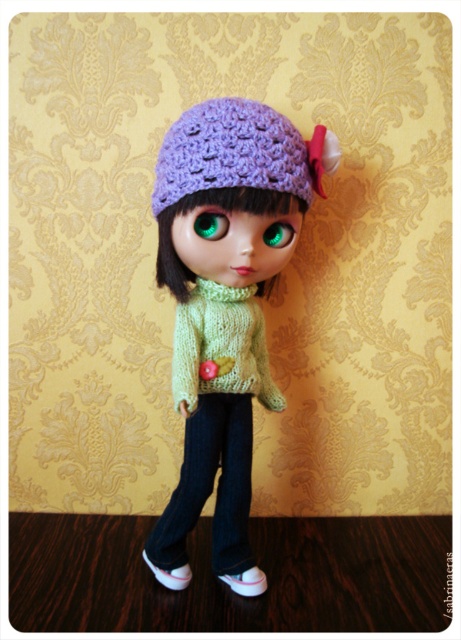
Question: Observing the image, what is the correct spatial positioning of knitted green sweater at center in reference to green glossy eye at center?

Choices:
 (A) above
 (B) below

Answer: (B)

Question: Which object is the closest to the green glossy eye at center?

Choices:
 (A) lavender crocheted hat at center
 (B) green matte eye at center

Answer: (B)

Question: Is lavender crocheted hat at center positioned behind green matte eye at center?

Choices:
 (A) no
 (B) yes

Answer: (A)

Question: Which object appears farthest from the camera in this image?

Choices:
 (A) white matte shoe at lower center
 (B) lavender knitted beanie at center
 (C) green matte eye at center
 (D) white matte shoe at lower left

Answer: (A)

Question: Can you confirm if white matte shoe at lower left is wider than green matte eye at center?

Choices:
 (A) no
 (B) yes

Answer: (B)

Question: Which of these objects is positioned closest to the lavender crocheted hat at center?

Choices:
 (A) green matte eye at center
 (B) knitted green sweater at center
 (C) lavender knitted beanie at center

Answer: (C)